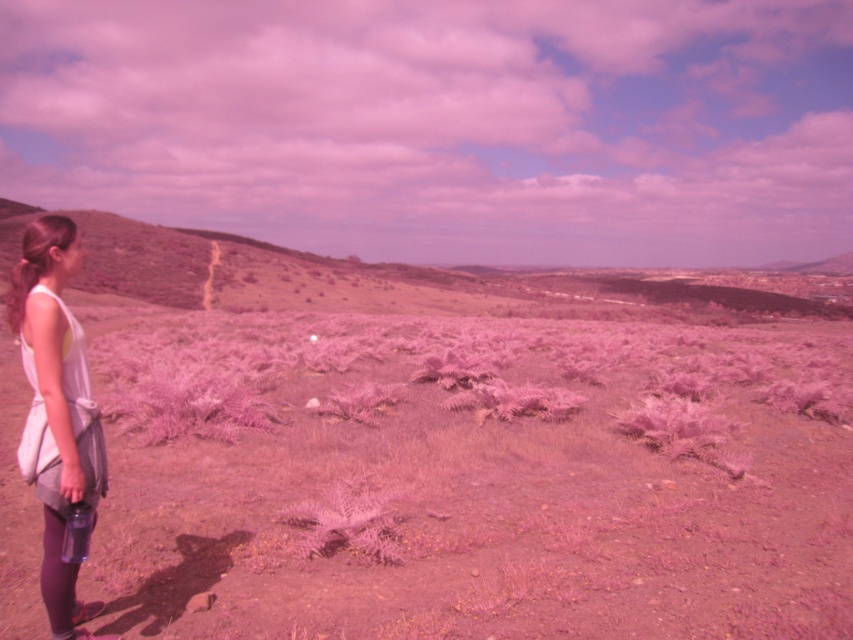
You are a photographer trying to capture the dusty pink dirt field at center and the dried grass at upper left in a single frame. Based on their positions, can you tell which object is closer to the camera?

The dusty pink dirt field at center is closer to the camera than the dried grass at upper left because it is positioned below it in the scene.

You are a photographer trying to capture a wide shot of the surreal landscape. You want to include both the dried grass at upper left and the white fabric dress at left in your photo. Given the distance between them, will you need to adjust your camera to a wider angle to fit both into the frame?

The distance between dried grass at upper left and white fabric dress at left is 50.04 meters. To capture both in a single wide shot, you would need to use a wider angle lens to ensure the entire 50.04 meters span fits within the frame.